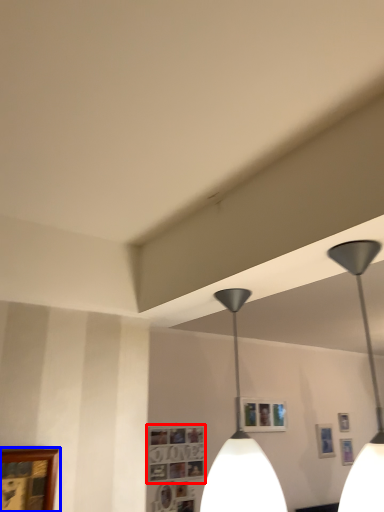
Question: Which of the following is the closest to the observer, picture frame (highlighted by a red box) or picture frame (highlighted by a blue box)?

Choices:
 (A) picture frame
 (B) picture frame

Answer: (B)